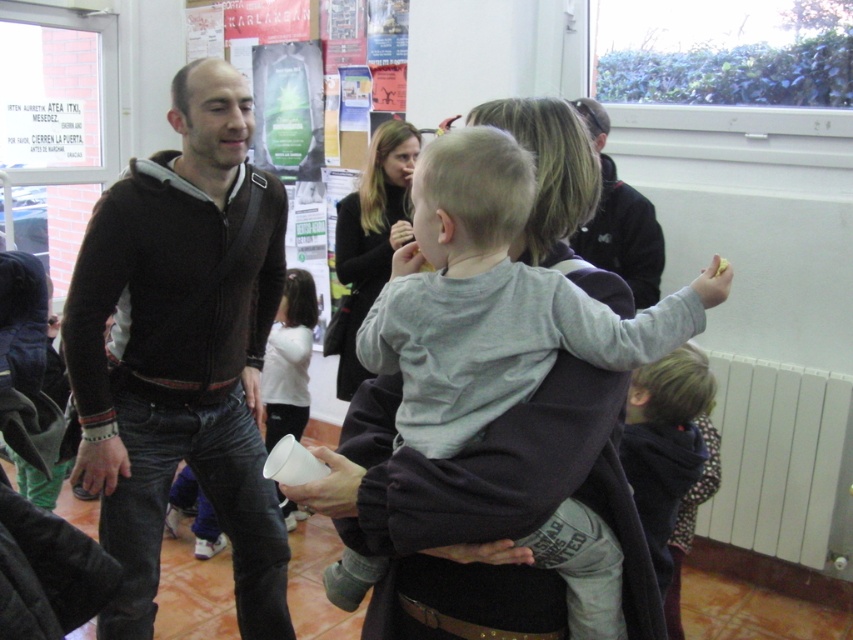
You are a photographer trying to capture a closeup shot of the gray cotton shirt at center. Your camera has a minimum focusing distance of 3 feet. Can you take the photo without moving the shirt?

The gray cotton shirt at center is 3.62 feet away from the camera. Since the minimum focusing distance is 3 feet, the camera can focus on the gray cotton shirt at center as it is within range.

You are a photographer trying to capture a candid shot of the child in the scene. The gray cotton shirt at center and the light brown hair at lower right are both in your viewfinder. Based on their sizes in the image, which object would you focus on first to ensure the child is in focus?

The gray cotton shirt at center has a greater height compared to the light brown hair at lower right. Since the gray cotton shirt is larger in size, focusing on it first would help ensure the child is in focus as it is a more prominent part of the child.

You are a photographer trying to capture a closeup of the gray cotton shirt at center. Given that your camera has a focal length of 50mm and you are currently 3 meters away from the shirt, can you estimate whether you need to move closer or farther away to focus on it properly?

The gray cotton shirt at center is positioned at coordinates point (494, 301), but without additional spatial information about the camera and subject relationship, it is not possible to determine the required adjustment for focusing. The given coordinates alone do not provide enough data to calculate distance changes for focus.